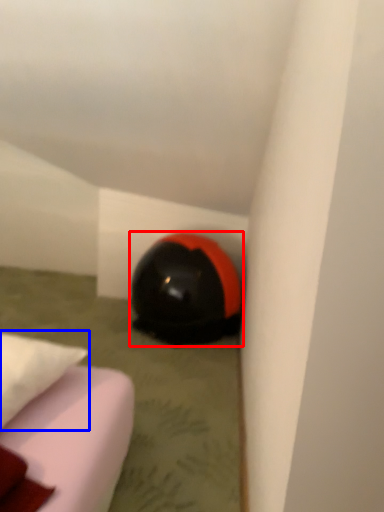
Question: Among these objects, which one is farthest to the camera, helmet (highlighted by a red box) or pillow (highlighted by a blue box)?

Choices:
 (A) helmet
 (B) pillow

Answer: (A)